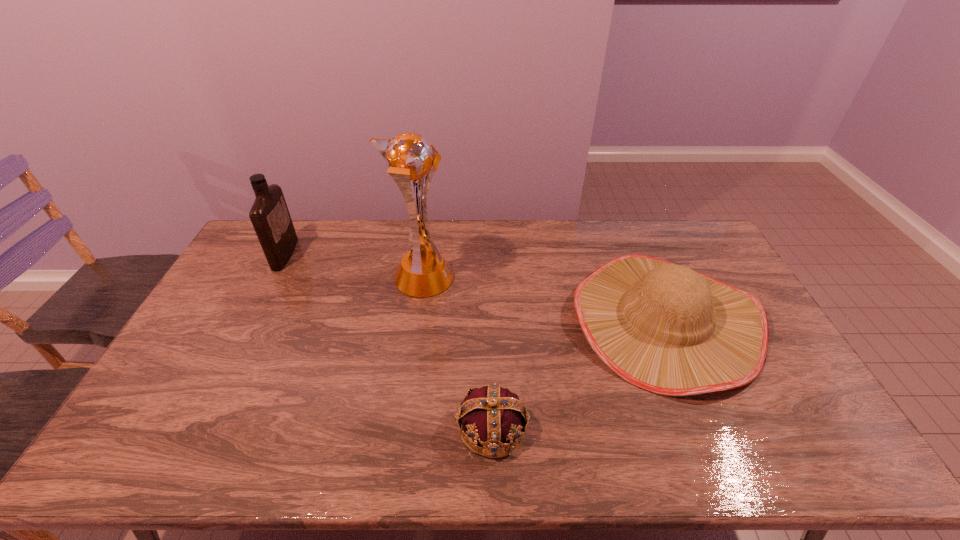
I want to click on vacant point located between the sunhat and the third object from left to right, so click(x=578, y=374).

Where is `vacant space that's between the third object from right to left and the sunhat`? This screenshot has height=540, width=960. vacant space that's between the third object from right to left and the sunhat is located at coordinates (543, 300).

Select which object appears as the third closest to the second object from right to left. Please provide its 2D coordinates. Your answer should be formatted as a tuple, i.e. [(x, y)], where the tuple contains the x and y coordinates of a point satisfying the conditions above.

[(269, 214)]

Locate an element on the screen. object that can be found as the second closest to the crown is located at coordinates 423,272.

Identify the location of blank area in the image that satisfies the following two spatial constraints: 1. on the label side of the liquor; 2. on the back side of the crown. (195, 428).

Image resolution: width=960 pixels, height=540 pixels. I want to click on free location that satisfies the following two spatial constraints: 1. on the front-facing side of the third object from right to left; 2. on the left side of the rightmost object, so click(x=416, y=321).

Find the location of a particular element. free space that satisfies the following two spatial constraints: 1. on the label side of the leftmost object; 2. on the right side of the sunhat is located at coordinates (251, 321).

Where is `vacant space that satisfies the following two spatial constraints: 1. on the front-facing side of the tallest object; 2. on the back side of the crown`? This screenshot has height=540, width=960. vacant space that satisfies the following two spatial constraints: 1. on the front-facing side of the tallest object; 2. on the back side of the crown is located at coordinates (400, 428).

Find the location of a particular element. vacant point that satisfies the following two spatial constraints: 1. on the front-facing side of the third object from left to right; 2. on the left side of the second object from left to right is located at coordinates (400, 428).

Identify the location of vacant area that satisfies the following two spatial constraints: 1. on the label side of the leftmost object; 2. on the right side of the shortest object. (195, 428).